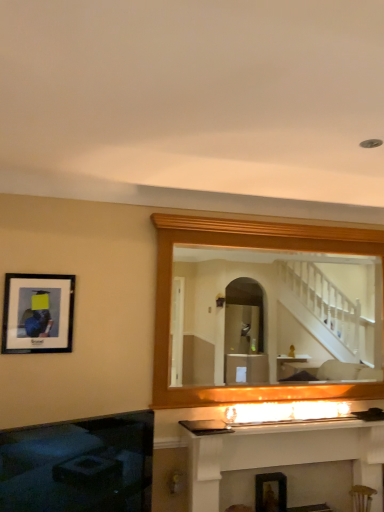
In order to face matte black picture frame at left, should I rotate leftwards or rightwards?

Turn left approximately 19.703 degrees to face it.

What do you see at coordinates (278, 312) in the screenshot? I see `wooden mirror at upper center` at bounding box center [278, 312].

The image size is (384, 512). In order to click on matte black picture frame at left in this screenshot , I will do `click(38, 313)`.

Can we say wooden mirror at upper center lies outside black glass fireplace at lower left, the 2th fireplace viewed from the right?

Yes, wooden mirror at upper center is not within black glass fireplace at lower left, the 2th fireplace viewed from the right.

Is wooden mirror at upper center wider than black glass fireplace at lower left, which ranks as the first fireplace in left-to-right order?

In fact, wooden mirror at upper center might be narrower than black glass fireplace at lower left, which ranks as the first fireplace in left-to-right order.

Is wooden mirror at upper center not close to black glass fireplace at lower left, which ranks as the first fireplace in left-to-right order?

wooden mirror at upper center is positioned a significant distance from black glass fireplace at lower left, which ranks as the first fireplace in left-to-right order.

Can you confirm if matte black picture frame at left is shorter than white glossy fireplace at center, positioned as the first fireplace in right-to-left order?

Indeed, matte black picture frame at left has a lesser height compared to white glossy fireplace at center, positioned as the first fireplace in right-to-left order.

Is matte black picture frame at left positioned with its back to white glossy fireplace at center, which is the second fireplace from left to right?

No, matte black picture frame at left is not facing the opposite direction of white glossy fireplace at center, which is the second fireplace from left to right.

From the image's perspective, is matte black picture frame at left located beneath white glossy fireplace at center, positioned as the first fireplace in right-to-left order?

No, from the image's perspective, matte black picture frame at left is not beneath white glossy fireplace at center, positioned as the first fireplace in right-to-left order.

Which object is wider, matte black picture frame at left or white glossy fireplace at center, which is the second fireplace from left to right?

white glossy fireplace at center, which is the second fireplace from left to right, is wider.

From a real-world perspective, is wooden mirror at upper center above or below white glossy fireplace at center, positioned as the first fireplace in right-to-left order?

wooden mirror at upper center is situated higher than white glossy fireplace at center, positioned as the first fireplace in right-to-left order, in the real world.

From the image's perspective, is wooden mirror at upper center beneath white glossy fireplace at center, which is the second fireplace from left to right?

Actually, wooden mirror at upper center appears above white glossy fireplace at center, which is the second fireplace from left to right, in the image.

In terms of width, does wooden mirror at upper center look wider or thinner when compared to white glossy fireplace at center, which is the second fireplace from left to right?

Clearly, wooden mirror at upper center has less width compared to white glossy fireplace at center, which is the second fireplace from left to right.

Which is behind, wooden mirror at upper center or white glossy fireplace at center, which is the second fireplace from left to right?

wooden mirror at upper center is more distant.

Is point (317, 315) positioned before point (19, 353)?

That is False.

Find the location of a particular element. picture frame located underneath the wooden mirror at upper center (from a real-world perspective) is located at coordinates (38, 313).

Is wooden mirror at upper center closer to camera compared to matte black picture frame at left?

No, wooden mirror at upper center is behind matte black picture frame at left.

Is point (130, 418) closer or farther from the camera than point (56, 307)?

Clearly, point (130, 418) is more distant from the camera than point (56, 307).

Is black glass fireplace at lower left, which ranks as the first fireplace in left-to-right order, directly adjacent to matte black picture frame at left?

No, black glass fireplace at lower left, which ranks as the first fireplace in left-to-right order, is not next to matte black picture frame at left.

What's the angular difference between black glass fireplace at lower left, the 2th fireplace viewed from the right, and matte black picture frame at left's facing directions?

They differ by 22.2 degrees in their facing directions.

Is black glass fireplace at lower left, which ranks as the first fireplace in left-to-right order, closer to camera compared to matte black picture frame at left?

Yes, black glass fireplace at lower left, which ranks as the first fireplace in left-to-right order, is in front of matte black picture frame at left.

Does matte black picture frame at left contain black glass fireplace at lower left, the 2th fireplace viewed from the right?

No, black glass fireplace at lower left, the 2th fireplace viewed from the right, is not surrounded by matte black picture frame at left.

Which object is thinner, matte black picture frame at left or black glass fireplace at lower left, which ranks as the first fireplace in left-to-right order?

matte black picture frame at left is thinner.

Is matte black picture frame at left oriented away from black glass fireplace at lower left, the 2th fireplace viewed from the right?

No, black glass fireplace at lower left, the 2th fireplace viewed from the right, is not at the back of matte black picture frame at left.

Which is more to the right, matte black picture frame at left or black glass fireplace at lower left, the 2th fireplace viewed from the right?

Positioned to the right is black glass fireplace at lower left, the 2th fireplace viewed from the right.

Based on the photo, can you confirm if white glossy fireplace at center, positioned as the first fireplace in right-to-left order, is taller than wooden mirror at upper center?

Incorrect, the height of white glossy fireplace at center, positioned as the first fireplace in right-to-left order, is not larger of that of wooden mirror at upper center.

Considering the sizes of objects white glossy fireplace at center, which is the second fireplace from left to right, and wooden mirror at upper center in the image provided, who is thinner, white glossy fireplace at center, which is the second fireplace from left to right, or wooden mirror at upper center?

wooden mirror at upper center is thinner.

From the image's perspective, is white glossy fireplace at center, which is the second fireplace from left to right, above wooden mirror at upper center?

No, from the image's perspective, white glossy fireplace at center, which is the second fireplace from left to right, is not above wooden mirror at upper center.

Does white glossy fireplace at center, positioned as the first fireplace in right-to-left order, appear on the right side of wooden mirror at upper center?

Yes.

The height and width of the screenshot is (512, 384). In order to click on the 1st fireplace positioned below the wooden mirror at upper center (from a real-world perspective) in this screenshot , I will do `click(79, 465)`.

What are the coordinates of `picture frame lying above the white glossy fireplace at center, which is the second fireplace from left to right (from the image's perspective)` in the screenshot? It's located at (38, 313).

Estimate the real-world distances between objects in this image. Which object is further from white glossy fireplace at center, positioned as the first fireplace in right-to-left order, black glass fireplace at lower left, the 2th fireplace viewed from the right, or wooden mirror at upper center?

wooden mirror at upper center is positioned further to the anchor white glossy fireplace at center, positioned as the first fireplace in right-to-left order.

Based on their spatial positions, is white glossy fireplace at center, which is the second fireplace from left to right, or black glass fireplace at lower left, which ranks as the first fireplace in left-to-right order, further from wooden mirror at upper center?

Based on the image, black glass fireplace at lower left, which ranks as the first fireplace in left-to-right order, appears to be further to wooden mirror at upper center.

Based on their spatial positions, is black glass fireplace at lower left, the 2th fireplace viewed from the right, or wooden mirror at upper center closer to matte black picture frame at left?

Based on the image, black glass fireplace at lower left, the 2th fireplace viewed from the right, appears to be nearer to matte black picture frame at left.

Based on their spatial positions, is wooden mirror at upper center or matte black picture frame at left further from white glossy fireplace at center, positioned as the first fireplace in right-to-left order?

wooden mirror at upper center is positioned further to the anchor white glossy fireplace at center, positioned as the first fireplace in right-to-left order.

From the picture: When comparing their distances from wooden mirror at upper center, does matte black picture frame at left or black glass fireplace at lower left, which ranks as the first fireplace in left-to-right order, seem further?

Among the two, matte black picture frame at left is located further to wooden mirror at upper center.

Looking at the image, which one is located further to wooden mirror at upper center, white glossy fireplace at center, positioned as the first fireplace in right-to-left order, or matte black picture frame at left?

matte black picture frame at left is further to wooden mirror at upper center.

Considering their positions, is wooden mirror at upper center positioned closer to white glossy fireplace at center, positioned as the first fireplace in right-to-left order, than black glass fireplace at lower left, the 2th fireplace viewed from the right?

The object closer to white glossy fireplace at center, positioned as the first fireplace in right-to-left order, is black glass fireplace at lower left, the 2th fireplace viewed from the right.

Looking at the image, which one is located closer to white glossy fireplace at center, which is the second fireplace from left to right, black glass fireplace at lower left, which ranks as the first fireplace in left-to-right order, or matte black picture frame at left?

Among the two, black glass fireplace at lower left, which ranks as the first fireplace in left-to-right order, is located nearer to white glossy fireplace at center, which is the second fireplace from left to right.

At what (x,y) coordinates should I click in order to perform the action: click on mirror between black glass fireplace at lower left, the 2th fireplace viewed from the right, and white glossy fireplace at center, which is the second fireplace from left to right, from left to right. Please return your answer as a coordinate pair (x, y). Looking at the image, I should click on (278, 312).

What are the coordinates of `mirror situated between matte black picture frame at left and white glossy fireplace at center, positioned as the first fireplace in right-to-left order, from left to right` in the screenshot? It's located at (278, 312).

You are a GUI agent. You are given a task and a screenshot of the screen. Output one action in this format:
    pyautogui.click(x=<x>, y=<y>)
    Task: Click on the fireplace between matte black picture frame at left and wooden mirror at upper center in the horizontal direction
    The width and height of the screenshot is (384, 512).
    Given the screenshot: What is the action you would take?
    pyautogui.click(x=79, y=465)

Identify the location of fireplace between matte black picture frame at left and white glossy fireplace at center, positioned as the first fireplace in right-to-left order, in the horizontal direction. (79, 465).